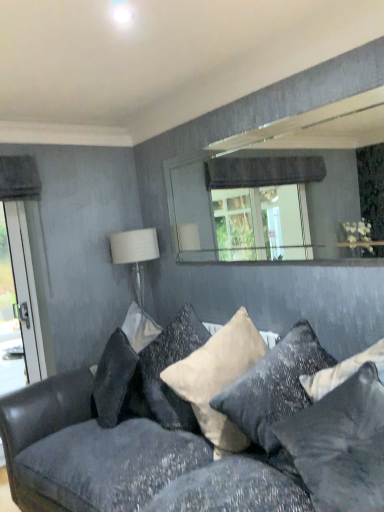
Question: Considering the positions of point (210, 340) and point (158, 357), is point (210, 340) closer or farther from the camera than point (158, 357)?

Choices:
 (A) farther
 (B) closer

Answer: (B)

Question: Based on their positions, is beige velvet pillow at center, which is the 2th pillow in back-to-front order, located to the left or right of velvet dark gray couch at lower center?

Choices:
 (A) left
 (B) right

Answer: (B)

Question: Considering the real-world distances, which object is farthest from the beige velvet pillow at center, which is the 2th pillow in back-to-front order?

Choices:
 (A) white fabric lampshade at upper right
 (B) velvet dark gray couch at lower center
 (C) white velvet pillow at center, which is the first pillow from back to front
 (D) textured gray curtain at upper right
 (E) velvet gray pillow at center, arranged as the 1th pillow when viewed from the front

Answer: (D)

Question: Estimate the real-world distances between objects in this image. Which object is farther from the white velvet pillow at center, which is the first pillow from back to front?

Choices:
 (A) beige velvet pillow at center, which is the 2th pillow in back-to-front order
 (B) textured gray curtain at upper right
 (C) velvet gray pillow at center, arranged as the 1th pillow when viewed from the front
 (D) velvet dark gray couch at lower center
 (E) white fabric lampshade at upper right

Answer: (B)